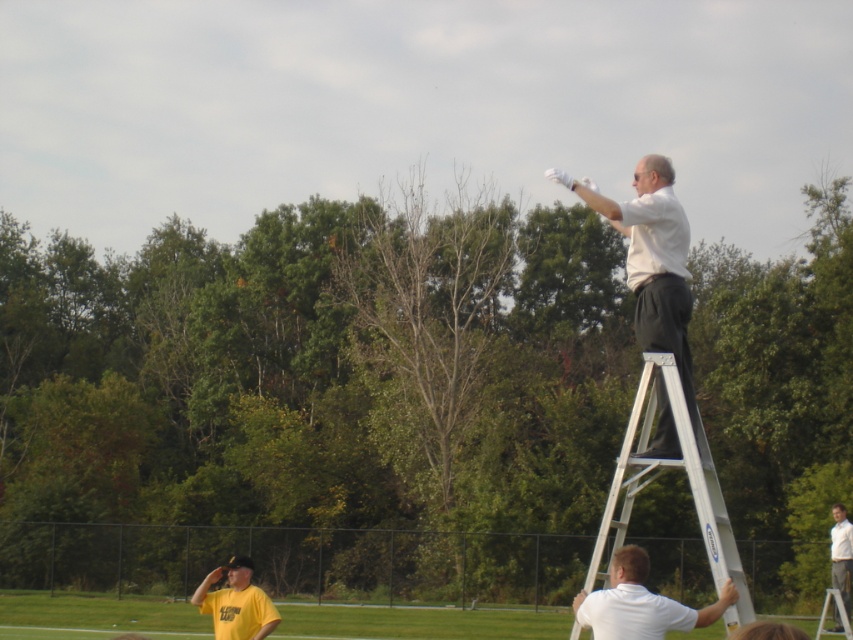
Is green grass football field at lower center bigger than yellow matte shirt at lower left?

Correct, green grass football field at lower center is larger in size than yellow matte shirt at lower left.

Does green grass football field at lower center come behind yellow matte shirt at lower left?

No, green grass football field at lower center is closer to the viewer.

What are the coordinates of `green grass football field at lower center` in the screenshot? It's located at (419, 621).

Identify the location of green grass football field at lower center. (419, 621).

Who is lower down, white matte shirt at upper right or white matte shirt at lower right?

white matte shirt at lower right is lower down.

This screenshot has width=853, height=640. Find the location of `white matte shirt at upper right`. white matte shirt at upper right is located at coordinates (653, 259).

At what (x,y) coordinates should I click in order to perform the action: click on white matte shirt at upper right. Please return your answer as a coordinate pair (x, y). This screenshot has height=640, width=853. Looking at the image, I should click on (653, 259).

Is silver metallic ladder at upper right positioned in front of white matte shirt at lower right?

Yes, silver metallic ladder at upper right is in front of white matte shirt at lower right.

Can you confirm if silver metallic ladder at upper right is taller than white matte shirt at lower right?

Indeed, silver metallic ladder at upper right has a greater height compared to white matte shirt at lower right.

Find the location of a particular element. This screenshot has width=853, height=640. silver metallic ladder at upper right is located at coordinates (688, 481).

Locate an element on the screen. The image size is (853, 640). silver metallic ladder at upper right is located at coordinates (688, 481).